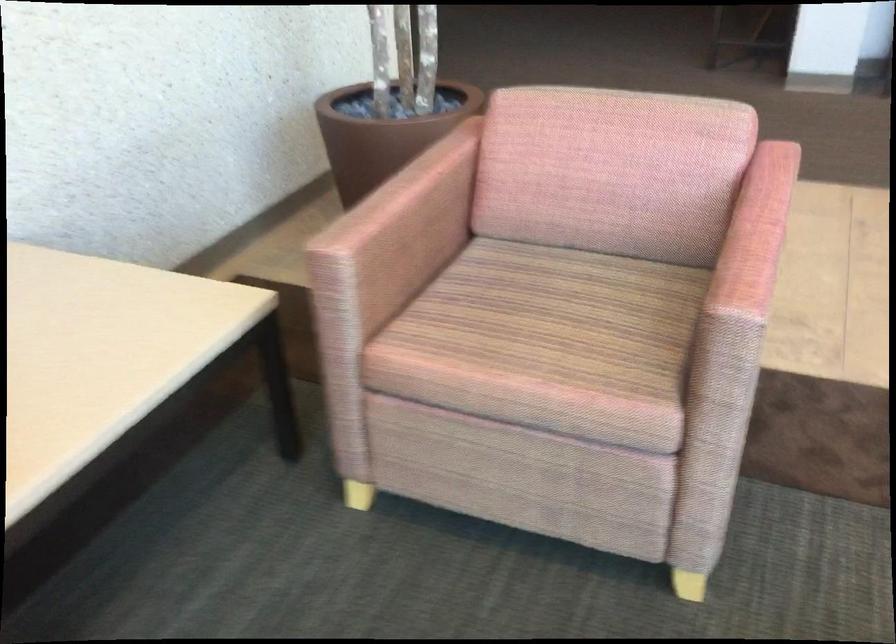
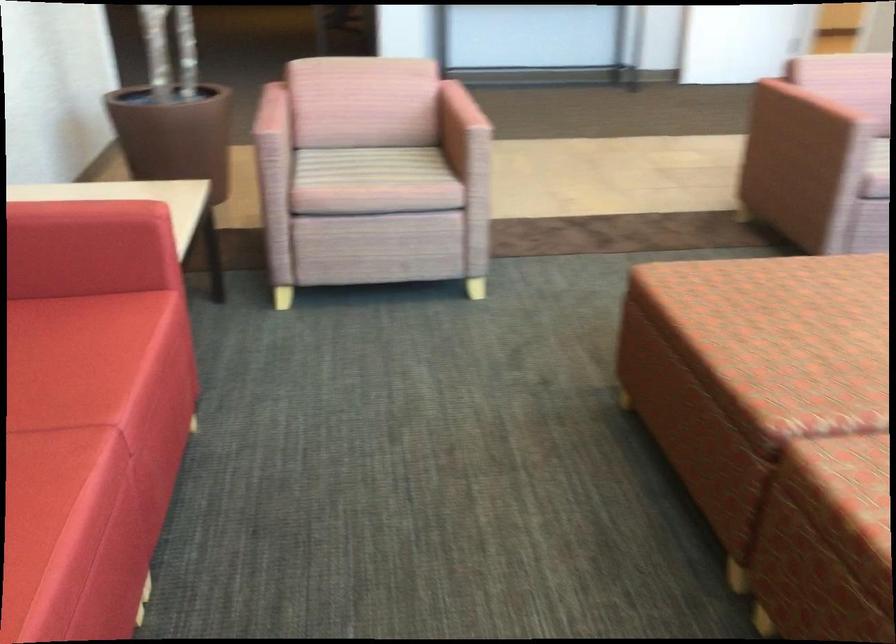
Locate, in the second image, the point that corresponds to (707,275) in the first image.

(459, 118)